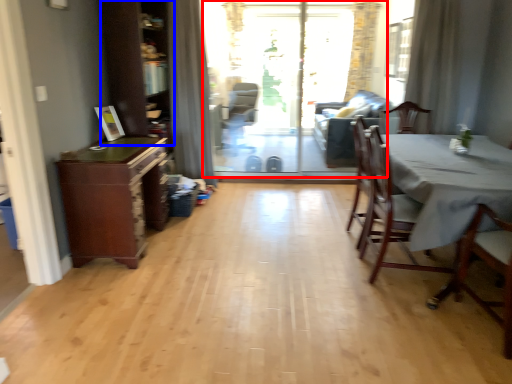
Question: Which object appears farthest to the camera in this image, screen door (highlighted by a red box) or dresser (highlighted by a blue box)?

Choices:
 (A) screen door
 (B) dresser

Answer: (A)